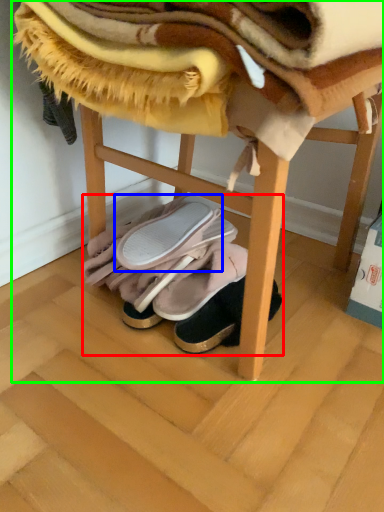
Question: Based on their relative distances, which object is nearer to footwear (highlighted by a red box)? Choose from footwear (highlighted by a blue box) and furniture (highlighted by a green box).

Choices:
 (A) footwear
 (B) furniture

Answer: (A)